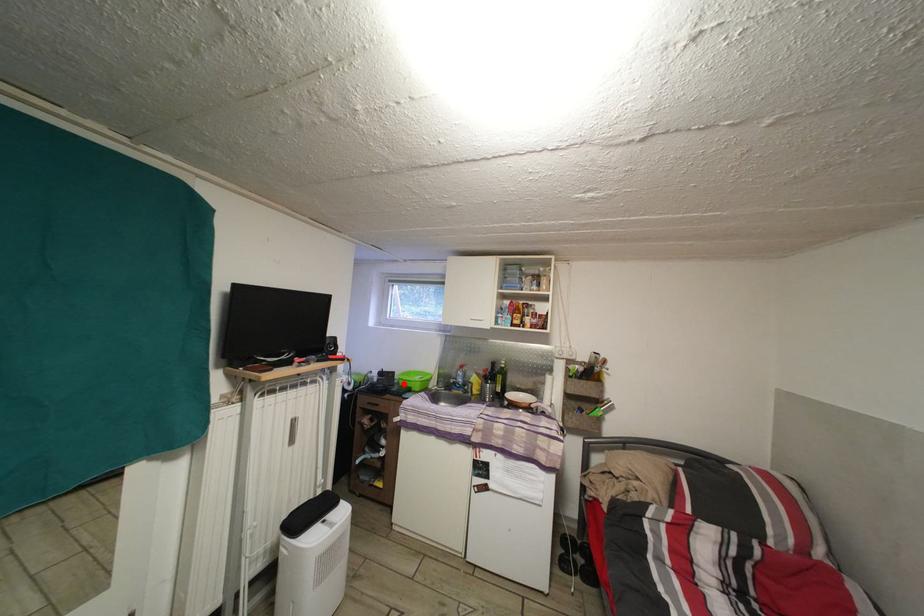
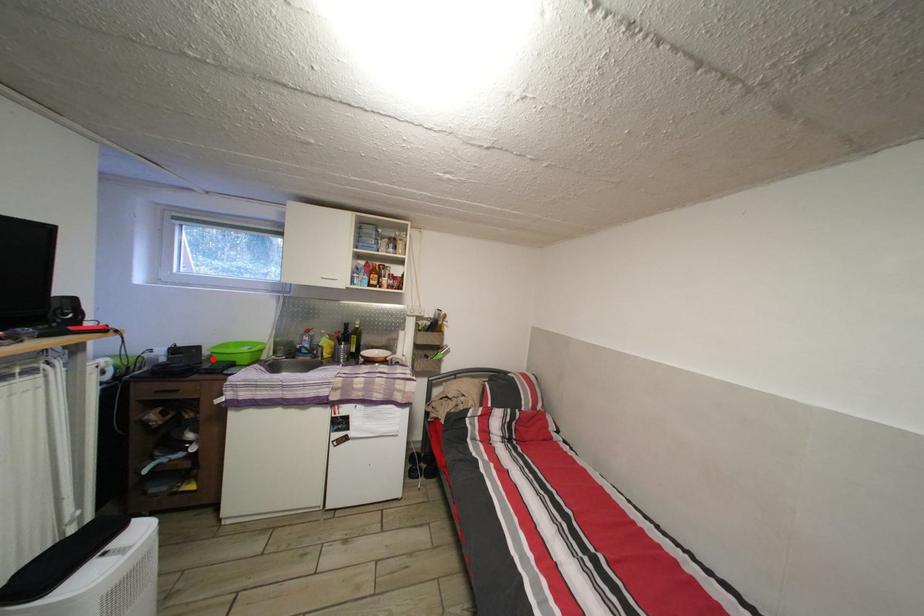
I am providing you with two images of the same scene from different viewpoints. A red point is marked on the first image and another point is marked on the second image. Is the marked point in image1 the same physical position as the marked point in image2?

Yes